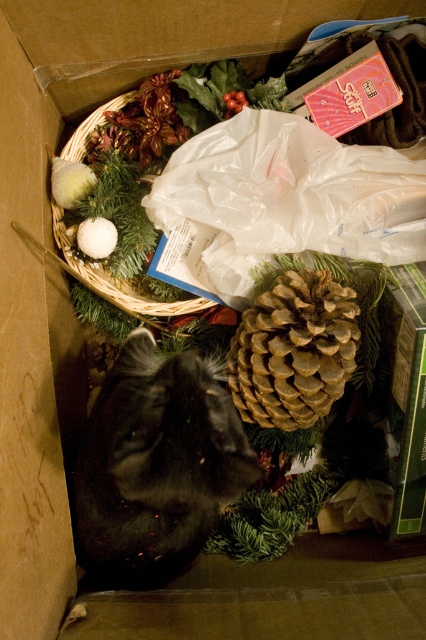
You are organizing items in the cardboard box and notice the black fluffy cat at lower left and the woven straw basket at upper left. Which object is located above the other?

The woven straw basket at upper left is above the black fluffy cat at lower left because the cat is positioned under the basket.

You are standing 1.7 meters tall and looking into a cardboard box filled with Christmas decorations. There is a point at coordinate point (86, 572) inside the box. If you want to reach that point with your hand, will you be able to touch it?

The point at coordinate point (86, 572) is 80.91 centimeters from the camera. Since you are 1.7 meters tall, your hand can extend approximately 1 meter forward, so you can reach and touch the point at coordinate point (86, 572).